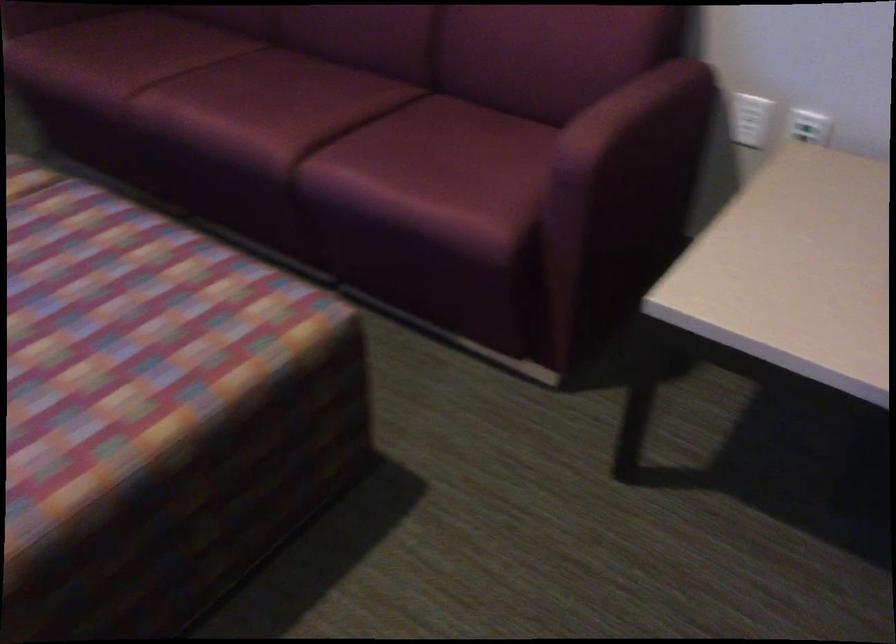
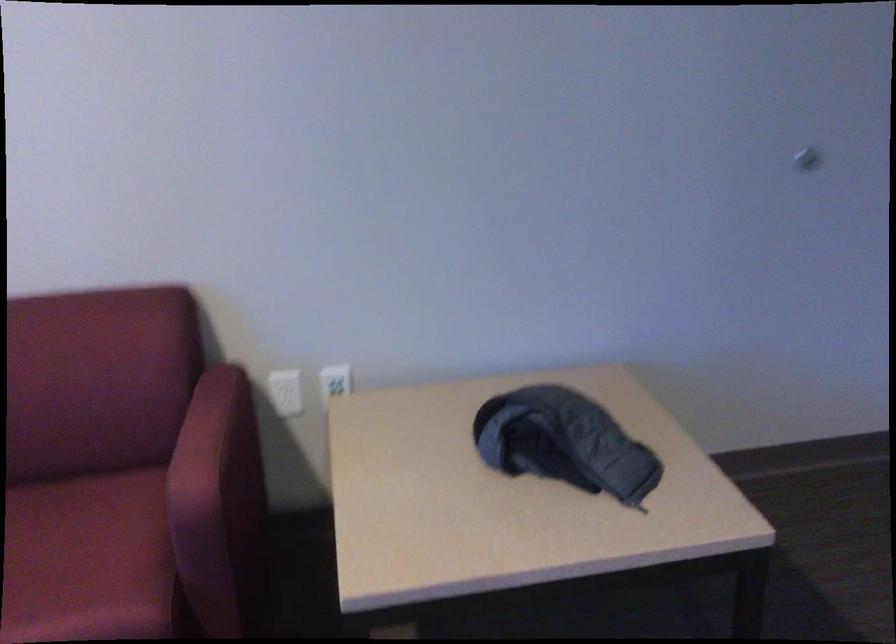
The point at (741, 120) is marked in the first image. Where is the corresponding point in the second image?

(286, 392)